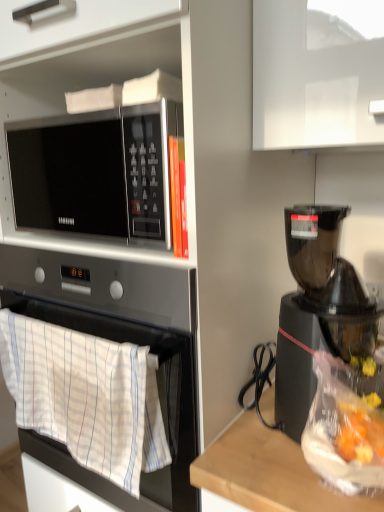
Question: Is white cotton towel at lower left to the left or to the right of black plastic coffee maker at right in the image?

Choices:
 (A) right
 (B) left

Answer: (B)

Question: Is white cotton towel at lower left situated inside black plastic coffee maker at right or outside?

Choices:
 (A) outside
 (B) inside

Answer: (A)

Question: Which is nearer to the sleek silver microwave at upper left?

Choices:
 (A) white cotton towel at lower left
 (B) black plastic coffee maker at right

Answer: (A)

Question: Based on their relative distances, which object is farther from the sleek silver microwave at upper left?

Choices:
 (A) black plastic coffee maker at right
 (B) white cotton towel at lower left

Answer: (A)